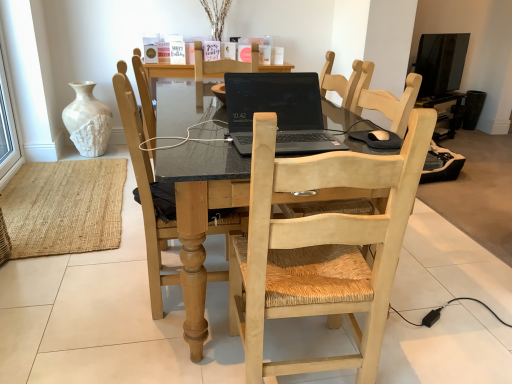
Find the location of `spots to the right of light wood woven seat at center, arranged as the first chair when viewed from the right`. spots to the right of light wood woven seat at center, arranged as the first chair when viewed from the right is located at coordinates (417, 348).